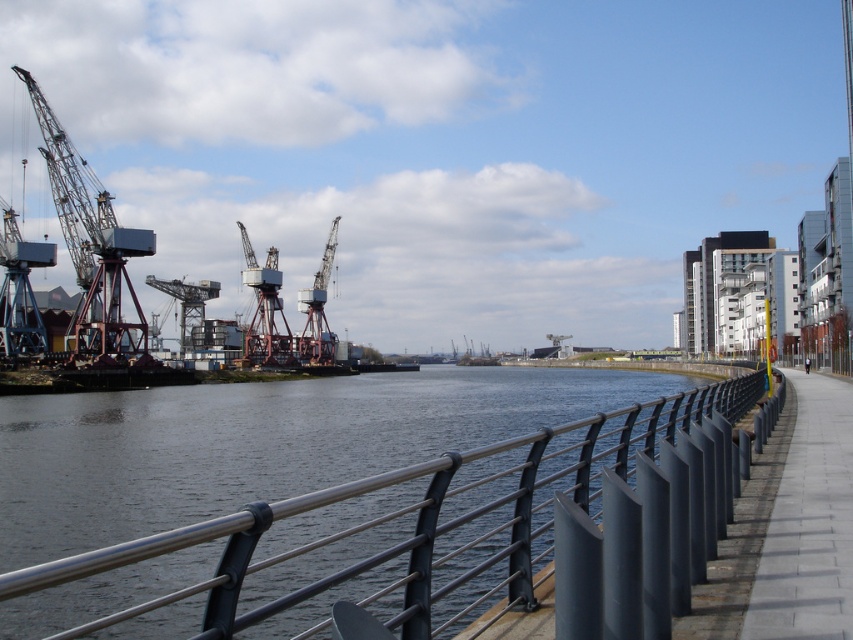
You are a pedestrian standing on the gray concrete sidewalk at right. You want to look up at the metallic industrial crane at left. Is the crane above or below you?

The gray concrete sidewalk at right is positioned under metallic industrial crane at left, so the crane is above you.

Based on the photo, you are standing on the walkway and want to take a photo of both the metallic industrial crane at left and the metallic industrial crane at center. Which crane should you position yourself closer to in order to capture both in the same frame?

You should position yourself closer to the metallic industrial crane at left because it is nearer to you than the metallic industrial crane at center, allowing both to be included in the photo frame more easily.